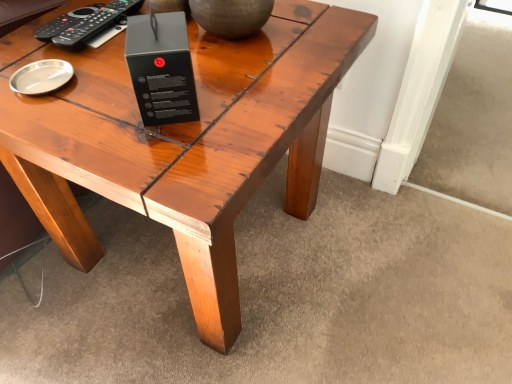
The height and width of the screenshot is (384, 512). Find the location of `vacant region below shiny wood table at center (from a real-world perspective)`. vacant region below shiny wood table at center (from a real-world perspective) is located at coordinates (178, 266).